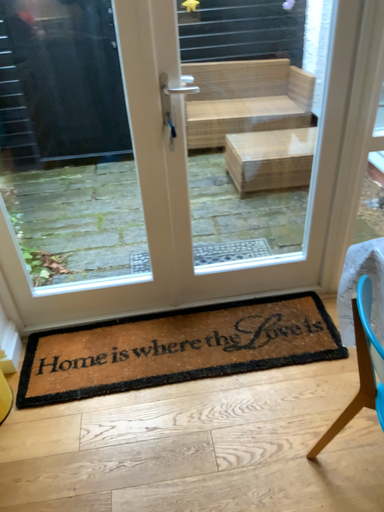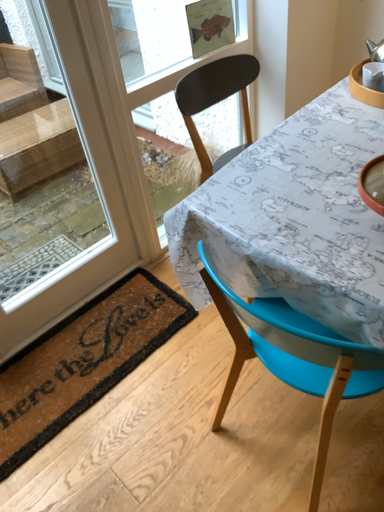
Question: How did the camera likely rotate when shooting the video?

Choices:
 (A) rotated left
 (B) rotated right

Answer: (B)